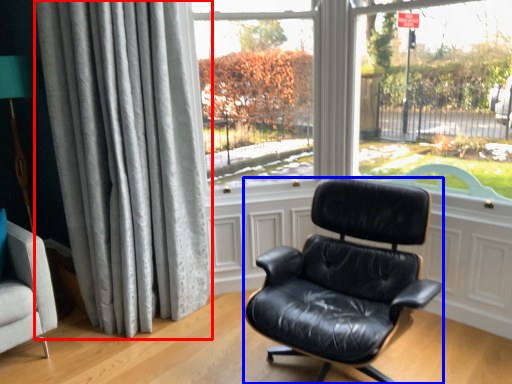
Question: Which point is further to the camera, curtain (highlighted by a red box) or chair (highlighted by a blue box)?

Choices:
 (A) curtain
 (B) chair

Answer: (A)